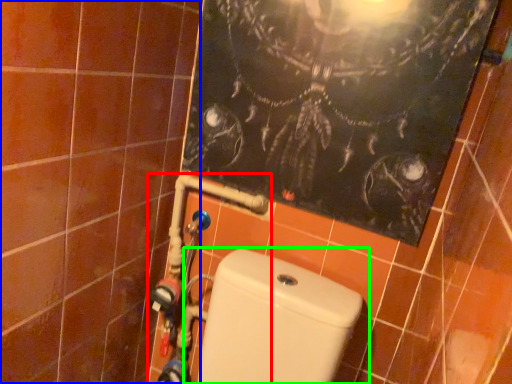
Question: Which is nearer to the water pipe (highlighted by a red box)? ceramic tile (highlighted by a blue box) or toilet (highlighted by a green box).

Choices:
 (A) ceramic tile
 (B) toilet

Answer: (B)